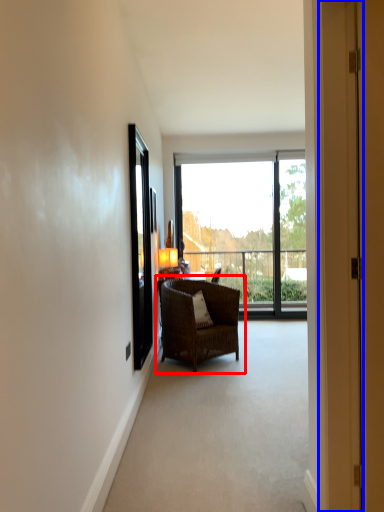
Question: Which of the following is the closest to the observer, chair (highlighted by a red box) or door (highlighted by a blue box)?

Choices:
 (A) chair
 (B) door

Answer: (B)